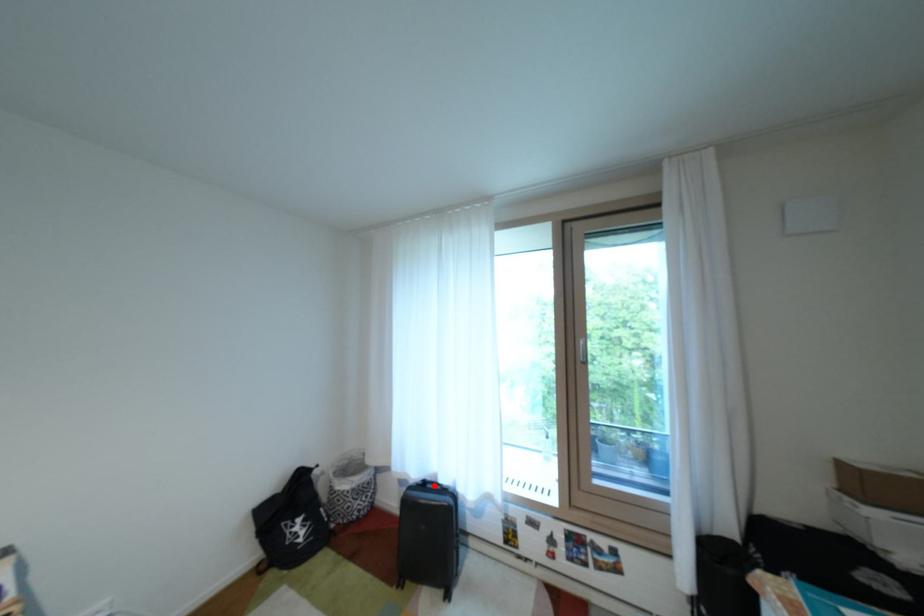
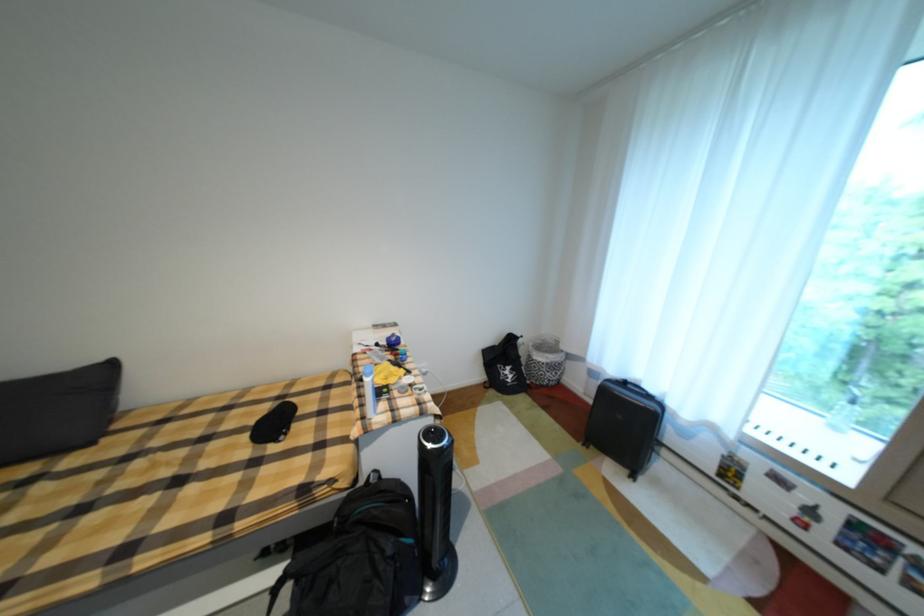
Where in the second image is the point corresponding to the highlighted location from the first image?

(635, 384)